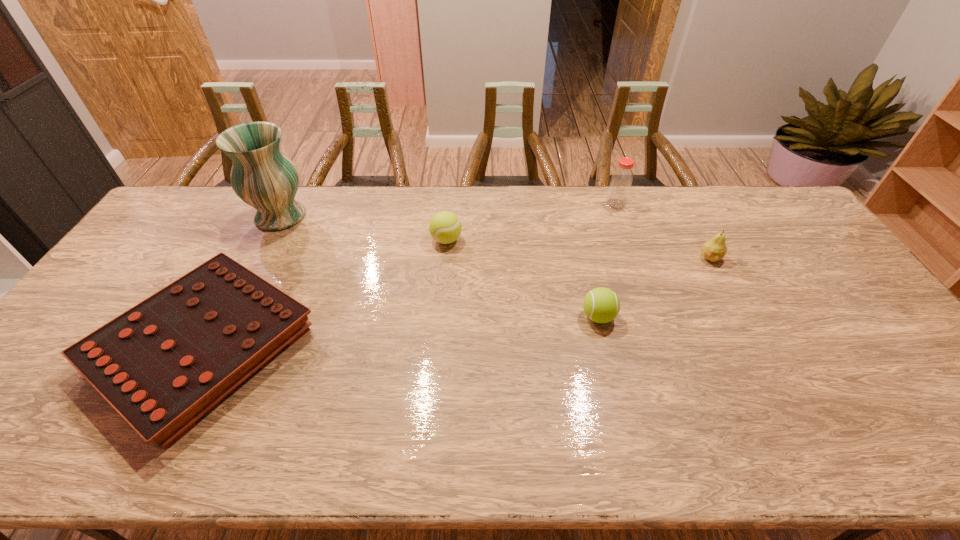
Find the location of `the tallest object`. the tallest object is located at coordinates (262, 176).

The image size is (960, 540). Identify the location of the fifth shortest object. (621, 181).

This screenshot has height=540, width=960. Find the location of `bottle`. bottle is located at coordinates (621, 181).

This screenshot has width=960, height=540. In order to click on the rightmost object in this screenshot , I will do `click(714, 249)`.

In order to click on the fourth object from right to left in this screenshot , I will do `click(445, 227)`.

Locate an element on the screen. the farther tennis ball is located at coordinates (445, 227).

Find the location of a particular element. The height and width of the screenshot is (540, 960). the fourth object from left to right is located at coordinates (601, 305).

Identify the location of the nearer tennis ball. (601, 305).

Locate an element on the screen. This screenshot has width=960, height=540. gameboard is located at coordinates (162, 364).

Locate an element on the screen. The height and width of the screenshot is (540, 960). free space located 0.080m on the back of the tallest object is located at coordinates (296, 186).